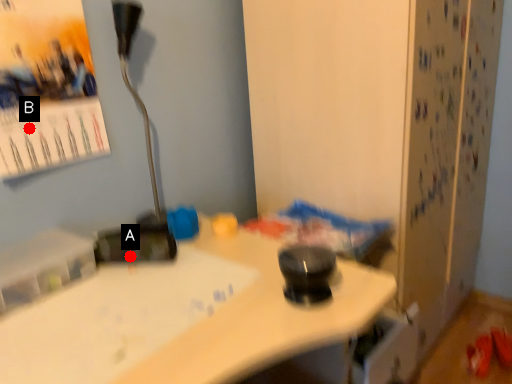
Question: Two points are circled on the image, labeled by A and B beside each circle. Which point is closer to the camera?

Choices:
 (A) A is closer
 (B) B is closer

Answer: (B)